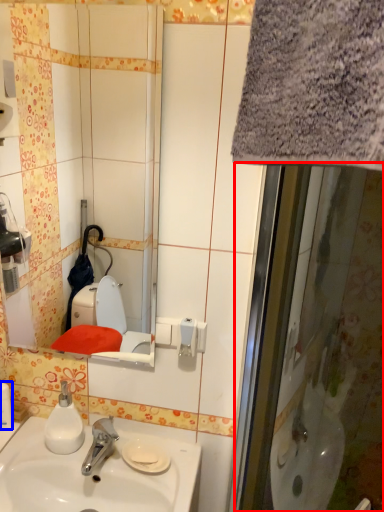
Question: Which object appears farthest to the camera in this image, screen door (highlighted by a red box) or toiletry (highlighted by a blue box)?

Choices:
 (A) screen door
 (B) toiletry

Answer: (B)